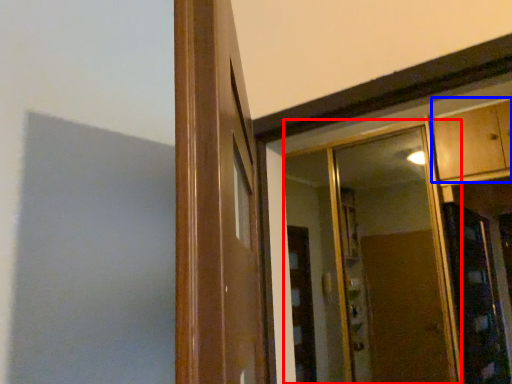
Question: Among these objects, which one is farthest to the camera, mirror (highlighted by a red box) or cabinetry (highlighted by a blue box)?

Choices:
 (A) mirror
 (B) cabinetry

Answer: (A)